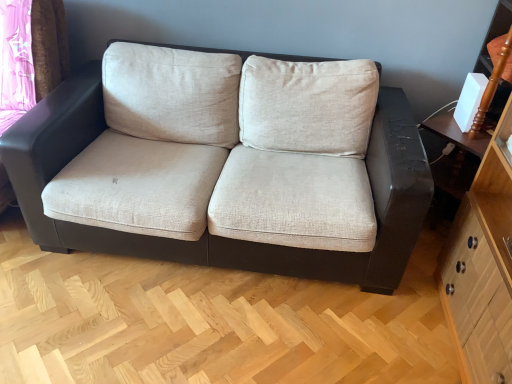
What do you see at coordinates (482, 264) in the screenshot? I see `light wood dresser at right` at bounding box center [482, 264].

What is the approximate width of light wood dresser at right?

15.91 inches.

Locate an element on the screen. The image size is (512, 384). light wood dresser at right is located at coordinates (482, 264).

Measure the distance between point [476,303] and camera.

1.42 meters.

Locate an element on the screen. The height and width of the screenshot is (384, 512). light wood dresser at right is located at coordinates (482, 264).